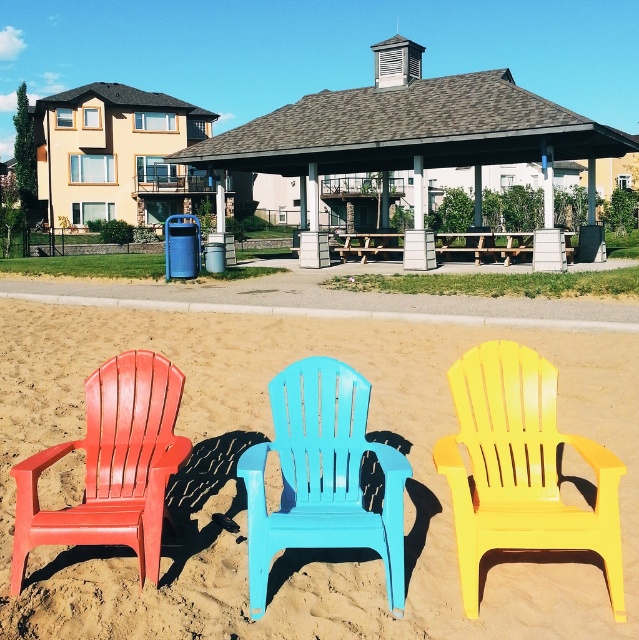
Question: Which of the following is the farthest from the observer?

Choices:
 (A) (144, 538)
 (B) (516, 468)
 (C) (564, 108)

Answer: (C)

Question: Is the position of smooth sand at center less distant than that of brown shingled gazebo at center?

Choices:
 (A) no
 (B) yes

Answer: (B)

Question: Can you confirm if smooth sand at center is positioned to the left of yellow plastic beach chair at center?

Choices:
 (A) yes
 (B) no

Answer: (A)

Question: Which of the following is the farthest from the observer?

Choices:
 (A) yellow plastic beach chair at center
 (B) matte plastic beach chair at left
 (C) light blue plastic chair at center
 (D) brown shingled gazebo at center

Answer: (D)

Question: Can you confirm if smooth sand at center is positioned below matte plastic beach chair at left?

Choices:
 (A) yes
 (B) no

Answer: (B)

Question: Which of the following is the closest to the observer?

Choices:
 (A) smooth sand at center
 (B) brown shingled gazebo at center
 (C) yellow plastic beach chair at center
 (D) matte plastic beach chair at left

Answer: (C)